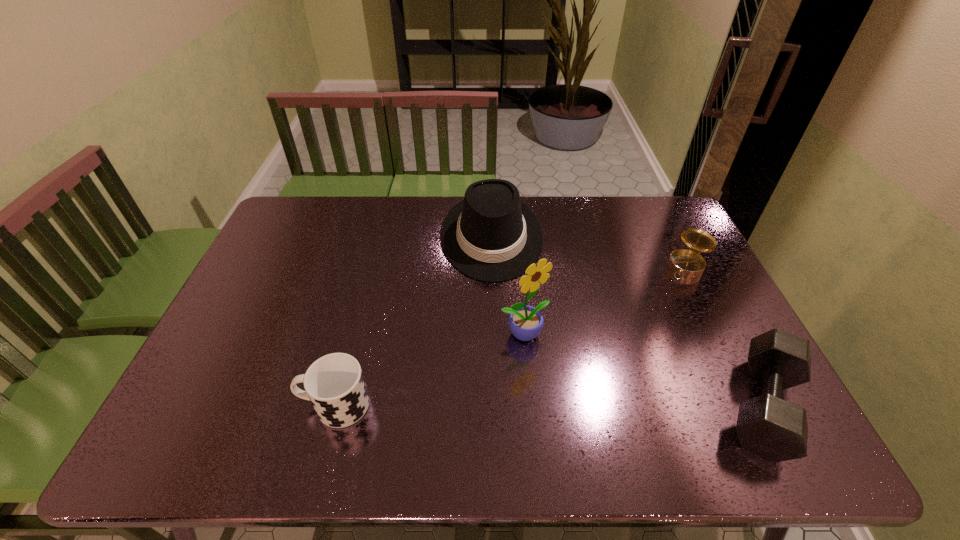
Locate an element on the screen. This screenshot has height=540, width=960. the leftmost object is located at coordinates (334, 383).

Find the location of a particular element. dumbbell is located at coordinates (767, 425).

Locate an element on the screen. the fourth shortest object is located at coordinates (490, 235).

Locate an element on the screen. the tallest object is located at coordinates (526, 322).

At what (x,y) coordinates should I click in order to perform the action: click on the third farthest object. Please return your answer as a coordinate pair (x, y). The height and width of the screenshot is (540, 960). Looking at the image, I should click on (526, 322).

Find the location of a particular element. The image size is (960, 540). compass is located at coordinates click(x=688, y=263).

Locate an element on the screen. free point located on the side of the leftmost object with the handle is located at coordinates (229, 404).

Find the location of `free space located on the side of the leftmost object with the handle`. free space located on the side of the leftmost object with the handle is located at coordinates [229, 404].

The image size is (960, 540). I want to click on vacant area located on the side of the leftmost object with the handle, so click(196, 404).

This screenshot has width=960, height=540. I want to click on vacant space located 0.210m on the back of the dumbbell, so click(x=708, y=296).